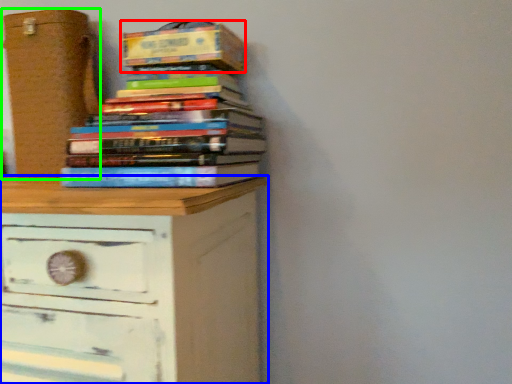
Question: Which object is the closest to the paperback book (highlighted by a red box)? Choose among these: chest of drawers (highlighted by a blue box) or cardboard box (highlighted by a green box).

Choices:
 (A) chest of drawers
 (B) cardboard box

Answer: (B)